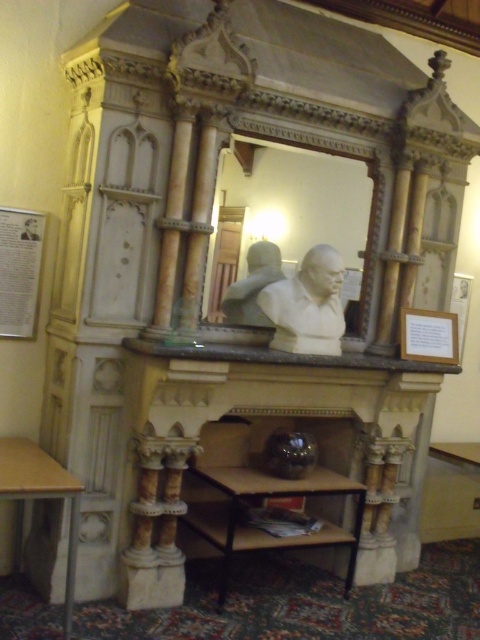
Does metallic black table at center appear on the left side of wooden table at lower left?

No, metallic black table at center is not to the left of wooden table at lower left.

What do you see at coordinates (261, 499) in the screenshot?
I see `metallic black table at center` at bounding box center [261, 499].

Where is `metallic black table at center`? The width and height of the screenshot is (480, 640). metallic black table at center is located at coordinates (261, 499).

Who is more distant from viewer, (291, 493) or (295, 292)?

The point (295, 292) is more distant.

Is point (235, 547) positioned before point (343, 328)?

That is True.

Find the location of a particular element. The width and height of the screenshot is (480, 640). metallic black table at center is located at coordinates (261, 499).

Is metallic black table at center bigger than satin bronze bust at center?

Indeed, metallic black table at center has a larger size compared to satin bronze bust at center.

Which is more to the right, metallic black table at center or satin bronze bust at center?

From the viewer's perspective, metallic black table at center appears more on the right side.

What are the coordinates of `metallic black table at center` in the screenshot? It's located at pos(261,499).

The image size is (480, 640). In order to click on metallic black table at center in this screenshot , I will do `click(261, 499)`.